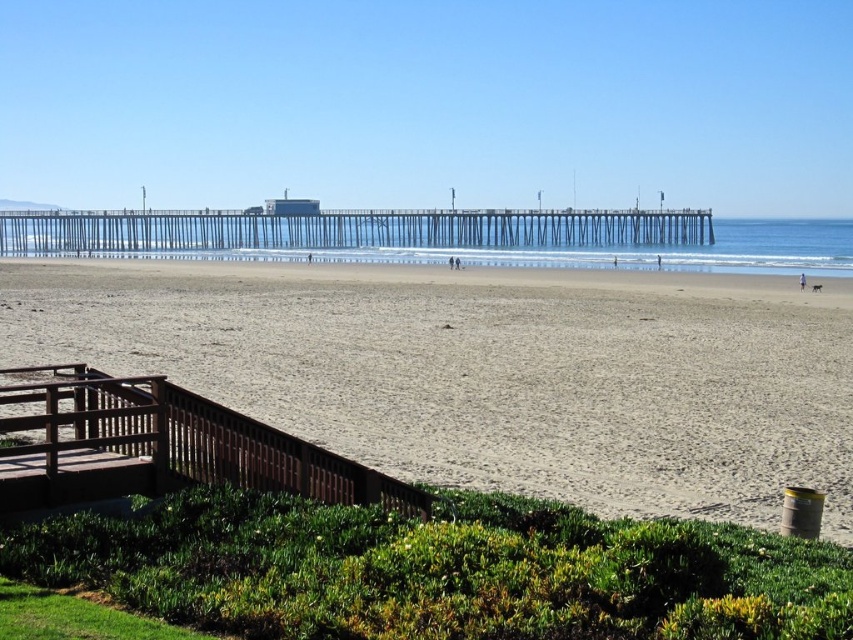
You are standing at the bottom of the brown wooden stairs at lower left and want to walk straight ahead to the light brown sand at center. Is the path clear of any obstacles?

The light brown sand at center is wider than the brown wooden stairs at lower left, so the path is clear and there are no obstacles in between.

You are standing at the wooden staircase leading down to the beach and want to reach the light brown sand at center. Which direction should you walk to get there?

The light brown sand at center is located at point (489, 371), so you should walk straight ahead towards the center of the beach to reach it.